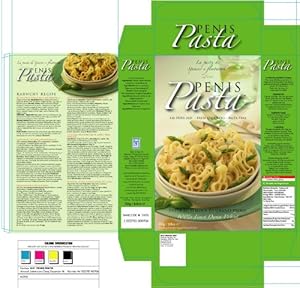
This screenshot has height=288, width=300. Find the location of `spoon`. spoon is located at coordinates (197, 123).